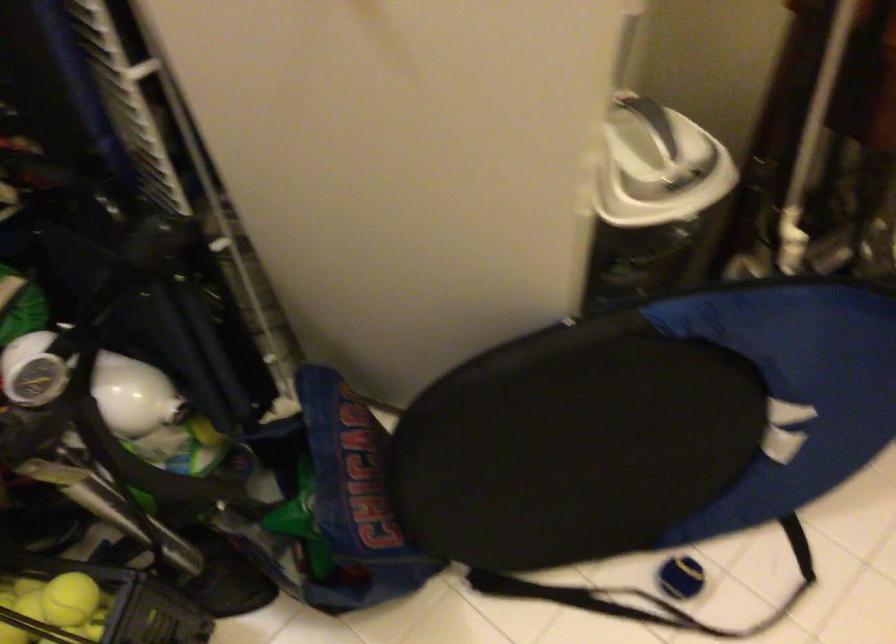
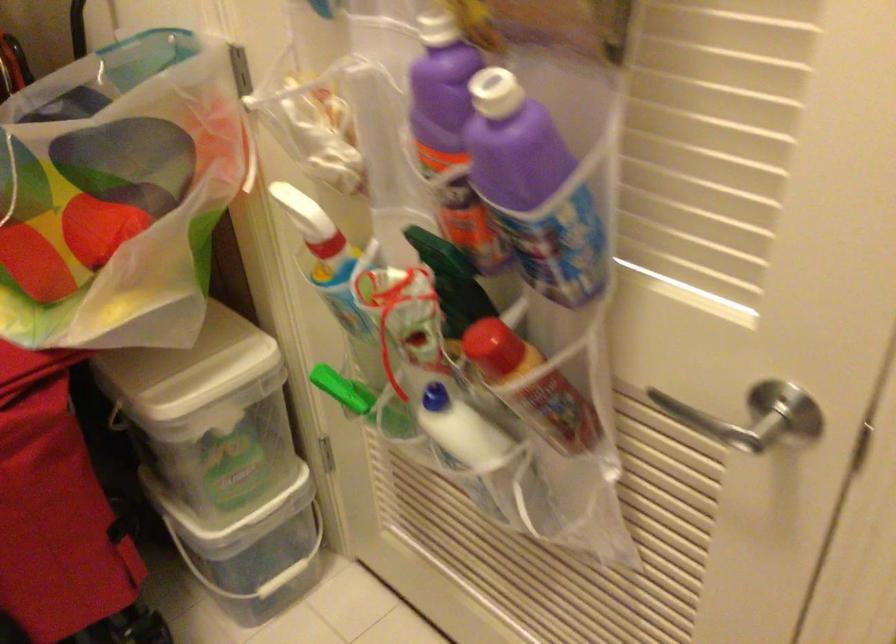
Question: How did the camera likely rotate?

Choices:
 (A) Left
 (B) Right
 (C) Up
 (D) Down

Answer: (B)